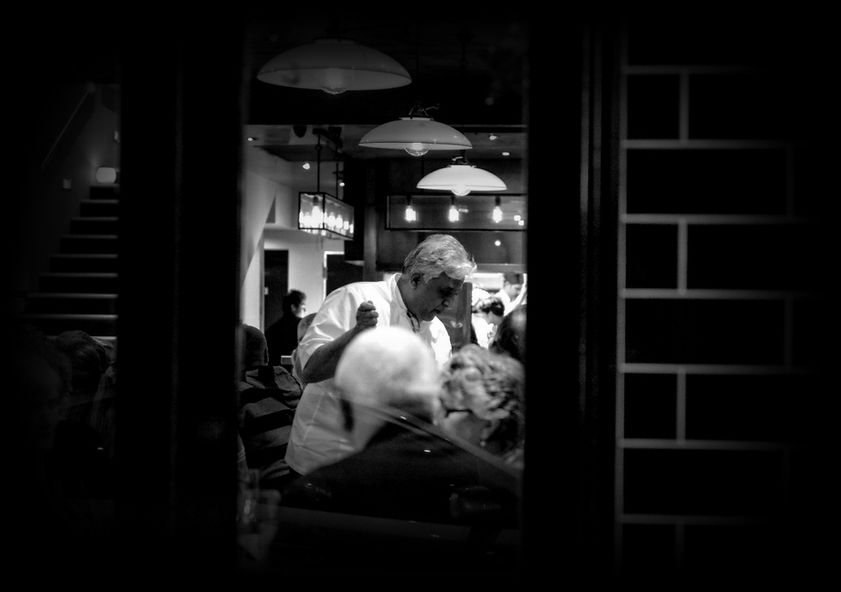
I want to click on light fixture, so click(x=414, y=138), click(x=468, y=184), click(x=331, y=78), click(x=315, y=214).